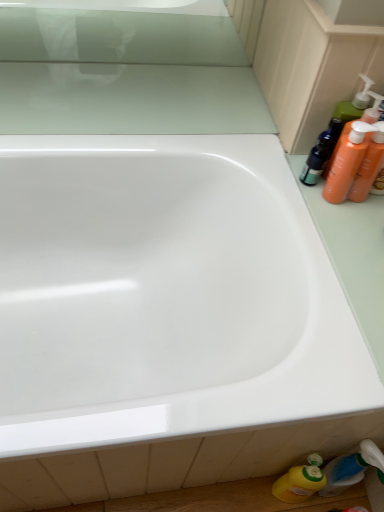
Where is `vacant space that is to the left of orange plastic bottles at upper right, the 1th toiletry from the top`? This screenshot has height=512, width=384. vacant space that is to the left of orange plastic bottles at upper right, the 1th toiletry from the top is located at coordinates pyautogui.click(x=267, y=157).